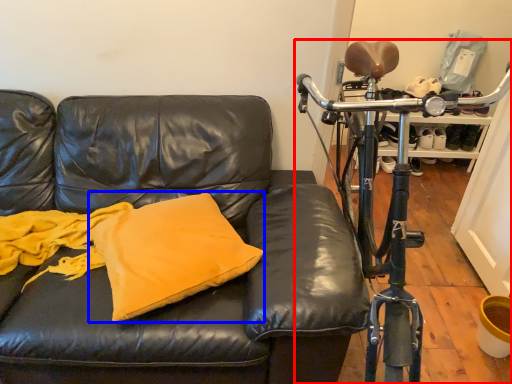
Question: Which point is further to the camera, bicycle (highlighted by a red box) or pillow (highlighted by a blue box)?

Choices:
 (A) bicycle
 (B) pillow

Answer: (B)